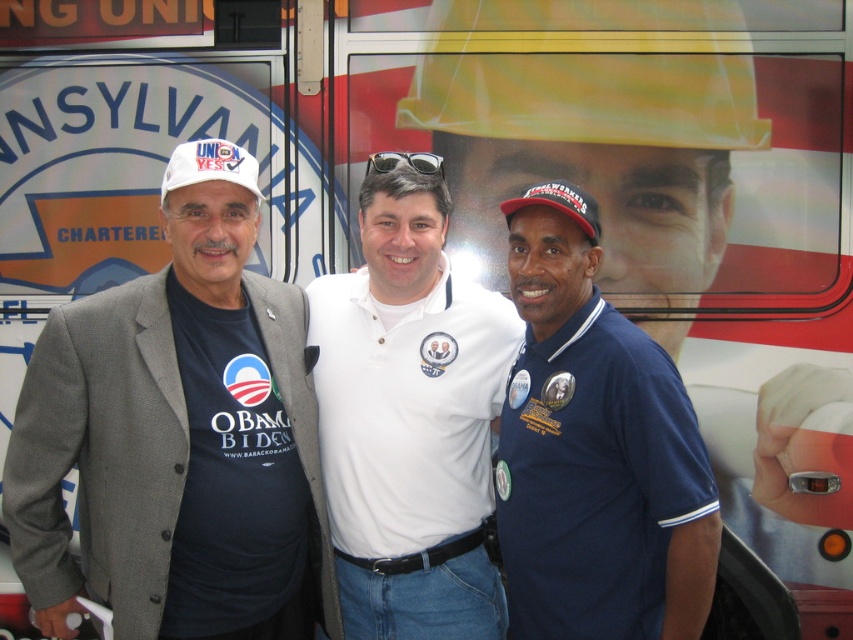
Can you confirm if gray wool blazer at left is positioned above navy blue polo shirt at center?

No, gray wool blazer at left is not above navy blue polo shirt at center.

The height and width of the screenshot is (640, 853). Find the location of `gray wool blazer at left`. gray wool blazer at left is located at coordinates (177, 445).

You are a GUI agent. You are given a task and a screenshot of the screen. Output one action in this format:
    pyautogui.click(x=<x>, y=<y>)
    Task: Click on the gray wool blazer at left
    This screenshot has width=853, height=640.
    Given the screenshot: What is the action you would take?
    pyautogui.click(x=177, y=445)

Based on the photo, can you confirm if gray wool blazer at left is bigger than white matte baseball hat at left?

Indeed, gray wool blazer at left has a larger size compared to white matte baseball hat at left.

Between gray wool blazer at left and white matte baseball hat at left, which one appears on the right side from the viewer's perspective?

From the viewer's perspective, white matte baseball hat at left appears more on the right side.

Is point (189, 289) more distant than point (193, 164)?

Yes.

This screenshot has height=640, width=853. In order to click on gray wool blazer at left in this screenshot , I will do point(177,445).

Between gray wool blazer at left and red fabric baseball cap at center, which one is positioned higher?

red fabric baseball cap at center is higher up.

Is gray wool blazer at left smaller than red fabric baseball cap at center?

Incorrect, gray wool blazer at left is not smaller in size than red fabric baseball cap at center.

Who is more distant from viewer, (9, 496) or (585, 196)?

The point (585, 196) is behind.

Locate an element on the screen. gray wool blazer at left is located at coordinates pos(177,445).